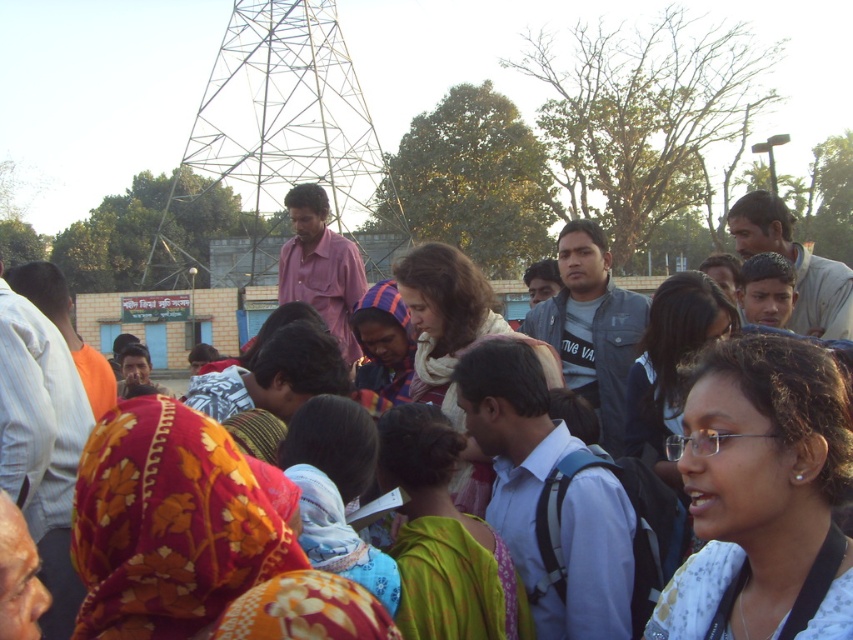
You are a photographer standing in the crowd at the event. You want to take a photo of the floral fabric headscarf at center without the white fabric at center blocking it. How should you adjust your position?

Move your camera position downward so that the white fabric at center is no longer above the floral fabric headscarf at center in your view.

Please provide the 2D coordinates of the white fabric at center in the image. The coordinates should be in the format of a point with two decimal places, like this example format, but do not include the example numbers. Use the provided description to answer.

The white fabric at center is located at point (762, 497).

You are attending a community event and see the metallic structure at upper center and the green floral sari at center. Which object is located to the left of the other?

The metallic structure at upper center is positioned on the left side of green floral sari at center.